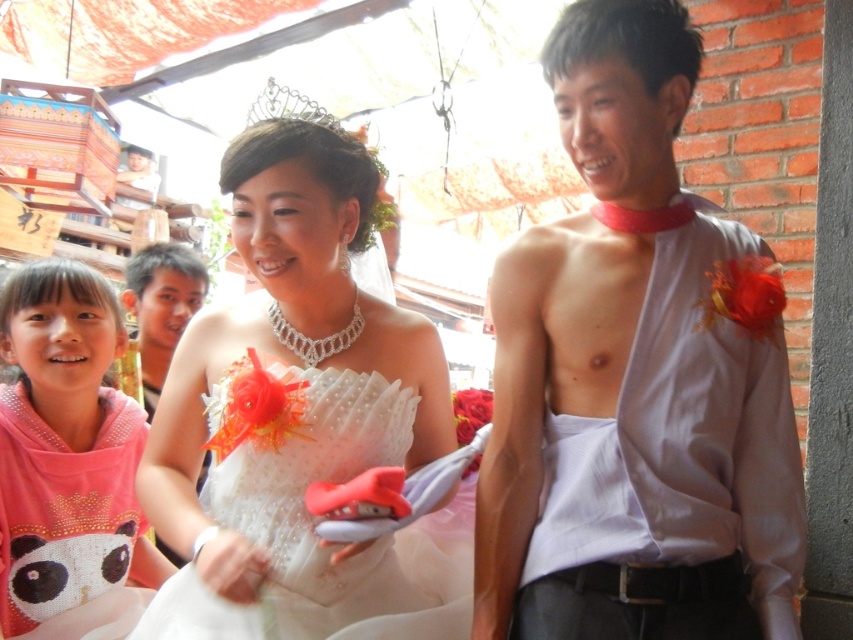
Based on the scene description, where is the matte gray shirt at right located in relation to the white satin dress at center?

The matte gray shirt at right is located to the right of the white satin dress at center.

You are a photographer at the wedding and want to ensure both the pink fabric at left and the matte black hair at upper left are visible in your shot. Which object should you focus on to capture both, considering their sizes?

The pink fabric at left is bigger than the matte black hair at upper left, so focusing on the pink fabric at left would help ensure both are visible in the shot since it occupies more space.

Please provide the coordinates of the white satin dress at center in the image.

The white satin dress at center is located at coordinates point (302, 417).